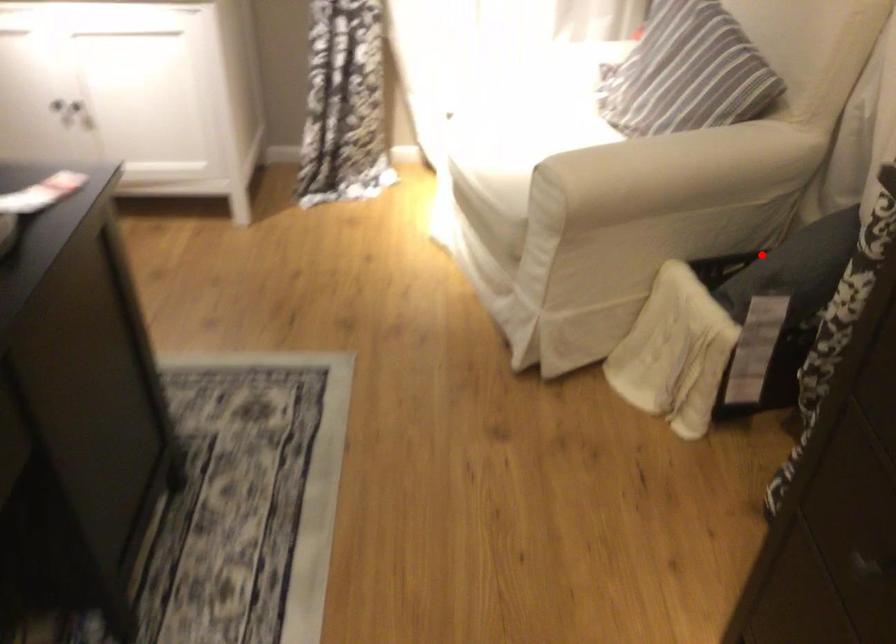
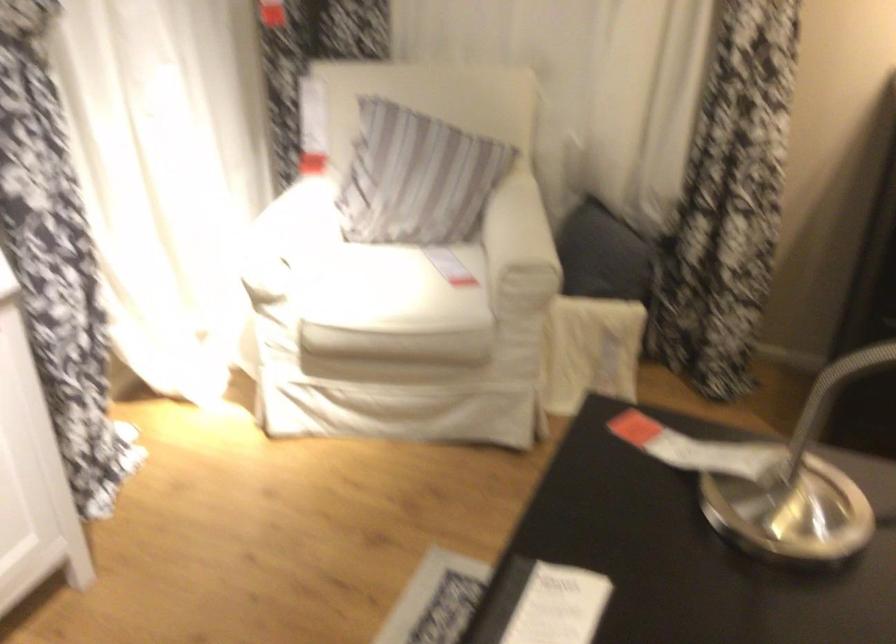
Question: A red point is marked in image1. In image2, is the corresponding 3D point closer to the camera or farther? Reply with the corresponding letter.

Choices:
 (A) The corresponding 3D point is closer.
 (B) The corresponding 3D point is farther.

Answer: (B)